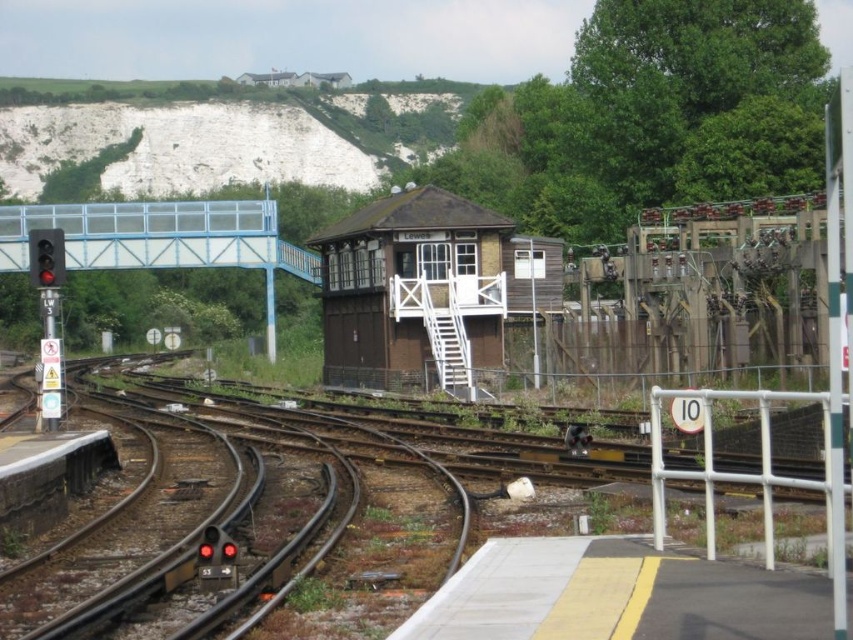
You are a train conductor trying to determine the best path for your train. You see the brown wooden track at center and the brown wooden signal box at center. Which object is wider?

The brown wooden track at center is wider than the brown wooden signal box at center according to the description.

You are standing at the scene and want to cross the brown wooden track at center safely. What should you do first?

You should first check if any trains are approaching on the brown wooden track at center before attempting to cross it.